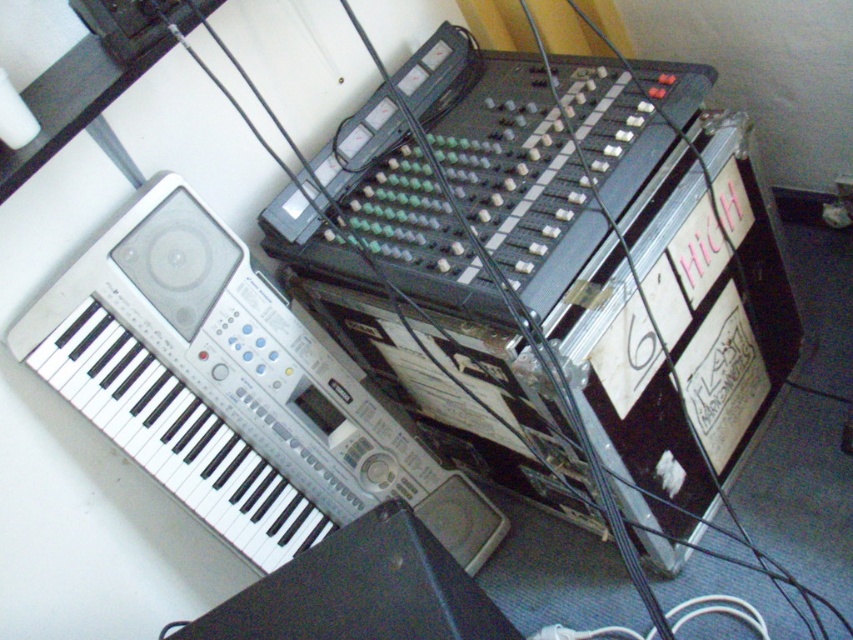
Question: Can you confirm if metallic gray mixer at center is positioned above white plastic keyboard at upper left?

Choices:
 (A) no
 (B) yes

Answer: (B)

Question: Can you confirm if metallic gray mixer at center is bigger than black plastic speaker at lower left?

Choices:
 (A) yes
 (B) no

Answer: (A)

Question: Among these objects, which one is farthest from the camera?

Choices:
 (A) metallic gray mixer at center
 (B) white plastic keyboard at upper left

Answer: (B)

Question: Observing the image, what is the correct spatial positioning of metallic gray mixer at center in reference to white plastic keyboard at upper left?

Choices:
 (A) left
 (B) right

Answer: (B)

Question: Which point appears closest to the camera in this image?

Choices:
 (A) (322, 570)
 (B) (222, 294)

Answer: (A)

Question: Which of the following is the closest to the observer?

Choices:
 (A) (625, 173)
 (B) (396, 570)

Answer: (B)